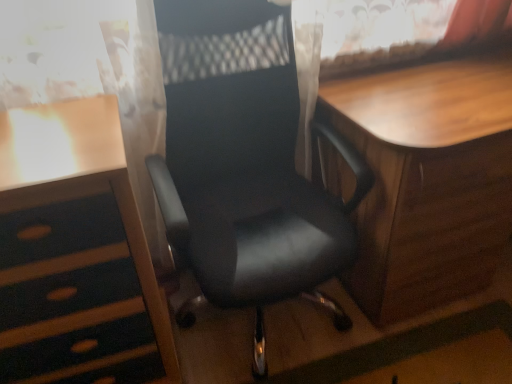
This screenshot has width=512, height=384. I want to click on free space underneath black leather chair at center (from a real-world perspective), so click(x=281, y=336).